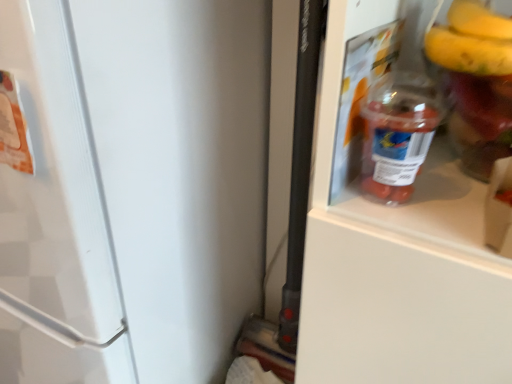
The image size is (512, 384). Identify the location of white matte refrigerator door at right. (181, 169).

What do you see at coordinates (181, 169) in the screenshot? The image size is (512, 384). I see `white matte refrigerator door at right` at bounding box center [181, 169].

This screenshot has height=384, width=512. What do you see at coordinates (401, 115) in the screenshot?
I see `translucent plastic bottle at center` at bounding box center [401, 115].

Find the location of `translucent plastic bottle at center`. translucent plastic bottle at center is located at coordinates (401, 115).

Locate an element on the screen. The image size is (512, 384). white matte refrigerator door at right is located at coordinates (181, 169).

Does white matte refrigerator door at right appear on the left side of translucent plastic bottle at center?

Indeed, white matte refrigerator door at right is positioned on the left side of translucent plastic bottle at center.

Does white matte refrigerator door at right lie in front of translucent plastic bottle at center?

Yes, the depth of white matte refrigerator door at right is less than that of translucent plastic bottle at center.

Which is behind, point (142, 152) or point (413, 31)?

The point (142, 152) is behind.

From the image's perspective, who appears lower, white matte refrigerator door at right or translucent plastic bottle at center?

white matte refrigerator door at right, from the image's perspective.

From a real-world perspective, is white matte refrigerator door at right positioned under translucent plastic bottle at center based on gravity?

Yes.

Can you confirm if white matte refrigerator door at right is thinner than translucent plastic bottle at center?

No.

Who is taller, white matte refrigerator door at right or translucent plastic bottle at center?

With more height is white matte refrigerator door at right.

Can you confirm if white matte refrigerator door at right is bigger than translucent plastic bottle at center?

Yes.

Is white matte refrigerator door at right positioned beyond the bounds of translucent plastic bottle at center?

white matte refrigerator door at right lies outside translucent plastic bottle at center's area.

Are white matte refrigerator door at right and translucent plastic bottle at center far apart?

white matte refrigerator door at right is near translucent plastic bottle at center, not far away.

Is white matte refrigerator door at right facing away from translucent plastic bottle at center?

No, translucent plastic bottle at center is not at the back of white matte refrigerator door at right.

How different are the orientations of white matte refrigerator door at right and translucent plastic bottle at center in degrees?

0.439 degrees.

How much distance is there between white matte refrigerator door at right and translucent plastic bottle at center?

They are 14.04 inches apart.

At what (x,y) coordinates should I click in order to perform the action: click on bottle behind the white matte refrigerator door at right. Please return your answer as a coordinate pair (x, y). The image size is (512, 384). Looking at the image, I should click on (401, 115).

Is translucent plastic bottle at center at the left side of white matte refrigerator door at right?

Incorrect, translucent plastic bottle at center is not on the left side of white matte refrigerator door at right.

Does translucent plastic bottle at center lie in front of white matte refrigerator door at right?

No, translucent plastic bottle at center is further to the viewer.

Which is nearer, [362,171] or [113,52]?

Point [362,171] is closer to the camera than point [113,52].

From the image's perspective, is translucent plastic bottle at center located above or below white matte refrigerator door at right?

From the image's perspective, translucent plastic bottle at center appears above white matte refrigerator door at right.

From a real-world perspective, which is physically below, translucent plastic bottle at center or white matte refrigerator door at right?

From a 3D spatial view, white matte refrigerator door at right is below.

Considering the relative sizes of translucent plastic bottle at center and white matte refrigerator door at right in the image provided, is translucent plastic bottle at center thinner than white matte refrigerator door at right?

Correct, the width of translucent plastic bottle at center is less than that of white matte refrigerator door at right.

Considering the relative sizes of translucent plastic bottle at center and white matte refrigerator door at right in the image provided, is translucent plastic bottle at center taller than white matte refrigerator door at right?

No.

Can you confirm if translucent plastic bottle at center is smaller than white matte refrigerator door at right?

Yes.

Is white matte refrigerator door at right completely or partially inside translucent plastic bottle at center?

That's incorrect, white matte refrigerator door at right is not inside translucent plastic bottle at center.

Are translucent plastic bottle at center and white matte refrigerator door at right making contact?

translucent plastic bottle at center is not next to white matte refrigerator door at right, and they're not touching.

Could you tell me if translucent plastic bottle at center is turned towards white matte refrigerator door at right?

No, translucent plastic bottle at center is not oriented towards white matte refrigerator door at right.

How many degrees apart are the facing directions of translucent plastic bottle at center and white matte refrigerator door at right?

translucent plastic bottle at center and white matte refrigerator door at right are facing 0.439 degrees away from each other.

Locate an element on the screen. door that is below the translucent plastic bottle at center (from the image's perspective) is located at coordinates (181, 169).

The image size is (512, 384). Find the location of `door in front of the translucent plastic bottle at center`. door in front of the translucent plastic bottle at center is located at coordinates (181, 169).

Image resolution: width=512 pixels, height=384 pixels. In order to click on bottle behind the white matte refrigerator door at right in this screenshot , I will do `click(401, 115)`.